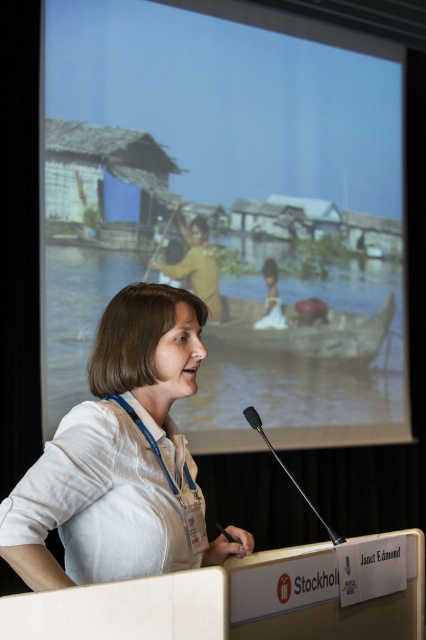
Question: Does white linen shirt at center have a lesser width compared to wooden boat at center?

Choices:
 (A) no
 (B) yes

Answer: (B)

Question: Which point appears closest to the camera in this image?

Choices:
 (A) (235, 547)
 (B) (186, 257)
 (C) (294, 480)
 (D) (377, 317)

Answer: (A)

Question: Which of the following is the farthest from the observer?

Choices:
 (A) matte plastic screen at upper center
 (B) wooden boat at center
 (C) yellow matte shirt at center

Answer: (B)

Question: Which is farther from the matte plastic screen at upper center?

Choices:
 (A) black metallic microphone at center
 (B) wooden boat at center

Answer: (A)

Question: Does wooden boat at center come behind yellow matte shirt at center?

Choices:
 (A) no
 (B) yes

Answer: (B)

Question: Is matte plastic screen at upper center wider than wooden boat at center?

Choices:
 (A) yes
 (B) no

Answer: (A)